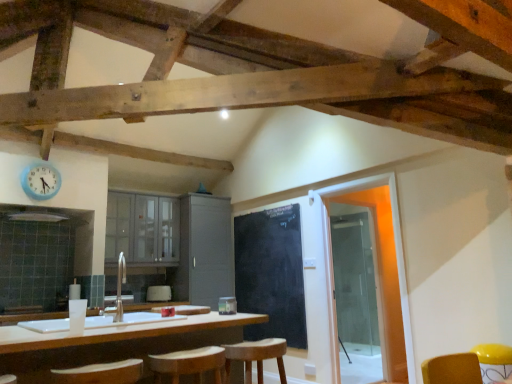
Question: Considering the relative sizes of wooden bar stool at center and matte gray cabinets at center, which is counted as the 2th cabinetry, starting from the right, in the image provided, is wooden bar stool at center bigger than matte gray cabinets at center, which is counted as the 2th cabinetry, starting from the right,?

Choices:
 (A) no
 (B) yes

Answer: (A)

Question: Is wooden bar stool at center aimed at matte gray cabinets at center, which is counted as the 2th cabinetry, starting from the right?

Choices:
 (A) yes
 (B) no

Answer: (B)

Question: Is wooden bar stool at center outside matte gray cabinets at center, marked as the first cabinetry in a left-to-right arrangement?

Choices:
 (A) no
 (B) yes

Answer: (B)

Question: Is wooden bar stool at center shorter than matte gray cabinets at center, marked as the first cabinetry in a left-to-right arrangement?

Choices:
 (A) yes
 (B) no

Answer: (A)

Question: From the image's perspective, would you say wooden bar stool at center is positioned over matte gray cabinets at center, which is counted as the 2th cabinetry, starting from the right?

Choices:
 (A) no
 (B) yes

Answer: (A)

Question: Is there a large distance between wooden bar stool at center and matte gray cabinets at center, marked as the first cabinetry in a left-to-right arrangement?

Choices:
 (A) yes
 (B) no

Answer: (A)

Question: From a real-world perspective, is transparent glass door at right beneath white matte countertop at center?

Choices:
 (A) no
 (B) yes

Answer: (A)

Question: Is transparent glass door at right looking in the opposite direction of white matte countertop at center?

Choices:
 (A) no
 (B) yes

Answer: (A)

Question: Considering the relative positions of transparent glass door at right and white matte countertop at center in the image provided, is transparent glass door at right to the left of white matte countertop at center from the viewer's perspective?

Choices:
 (A) no
 (B) yes

Answer: (A)

Question: Is transparent glass door at right outside of white matte countertop at center?

Choices:
 (A) yes
 (B) no

Answer: (A)

Question: Is transparent glass door at right smaller than white matte countertop at center?

Choices:
 (A) no
 (B) yes

Answer: (B)

Question: Does transparent glass door at right come behind white matte countertop at center?

Choices:
 (A) yes
 (B) no

Answer: (A)

Question: Is wooden bar stool at center surrounded by matte gray cabinet at center, the 1th cabinetry positioned from the right?

Choices:
 (A) yes
 (B) no

Answer: (B)